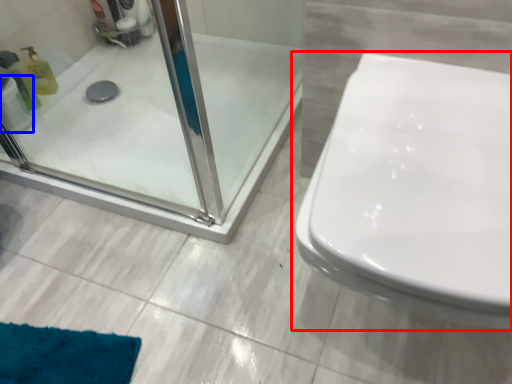
Question: Which of the following is the closest to the observer, toilet (highlighted by a red box) or toilet paper (highlighted by a blue box)?

Choices:
 (A) toilet
 (B) toilet paper

Answer: (A)